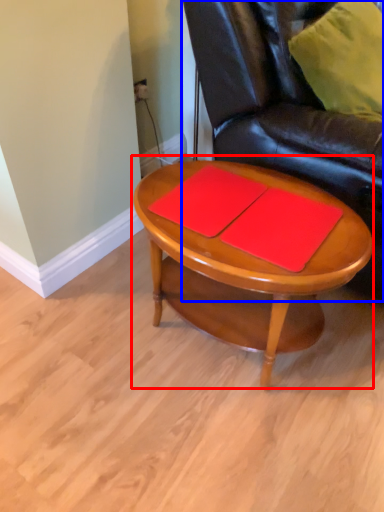
Question: Among these objects, which one is farthest to the camera, coffee table (highlighted by a red box) or chair (highlighted by a blue box)?

Choices:
 (A) coffee table
 (B) chair

Answer: (A)